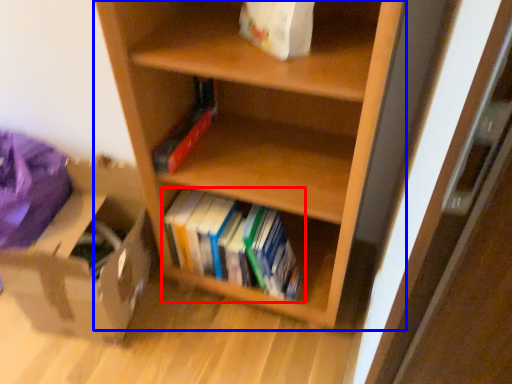
Question: Which of the following is the farthest to the observer, book (highlighted by a red box) or shelf (highlighted by a blue box)?

Choices:
 (A) book
 (B) shelf

Answer: (A)